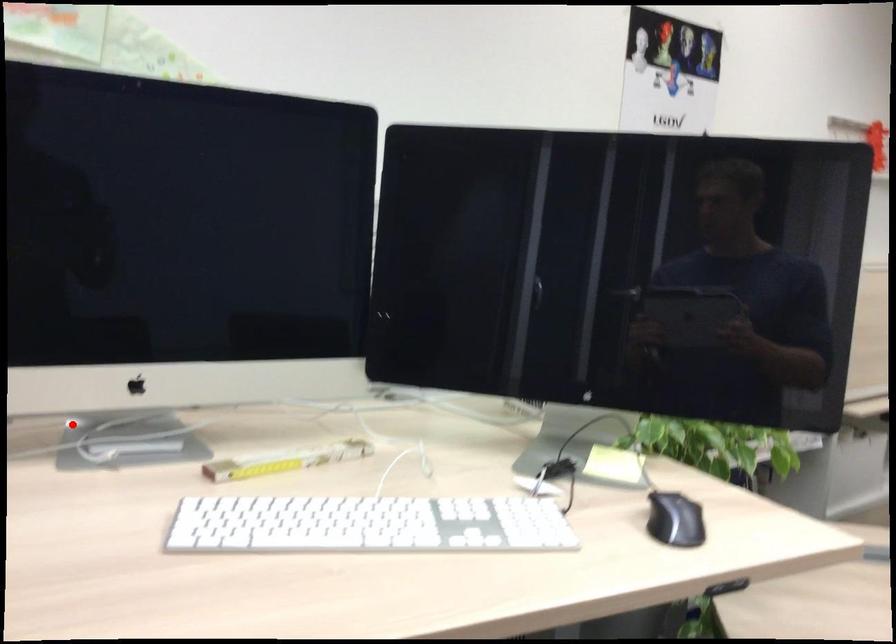
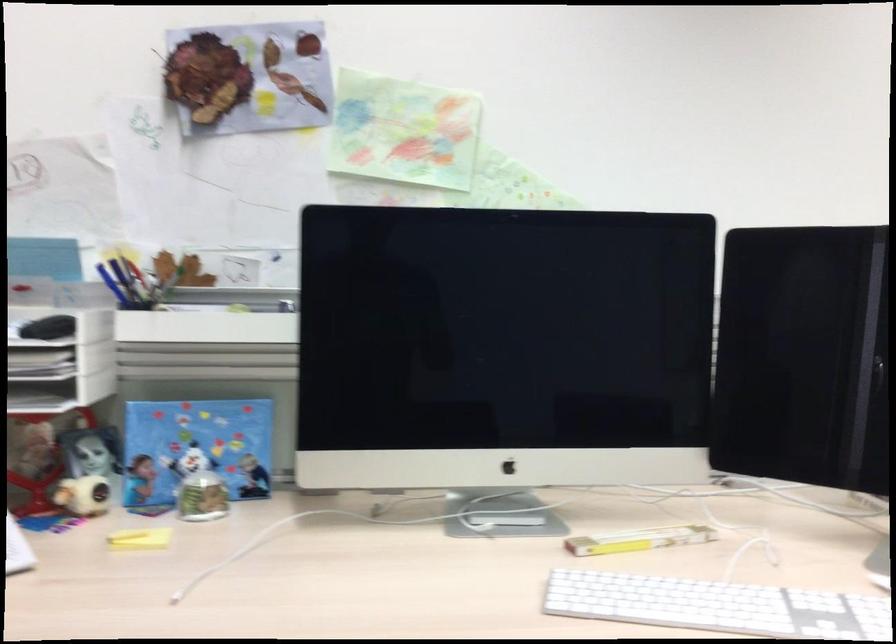
The point at the highlighted location is marked in the first image. Where is the corresponding point in the second image?

(449, 494)